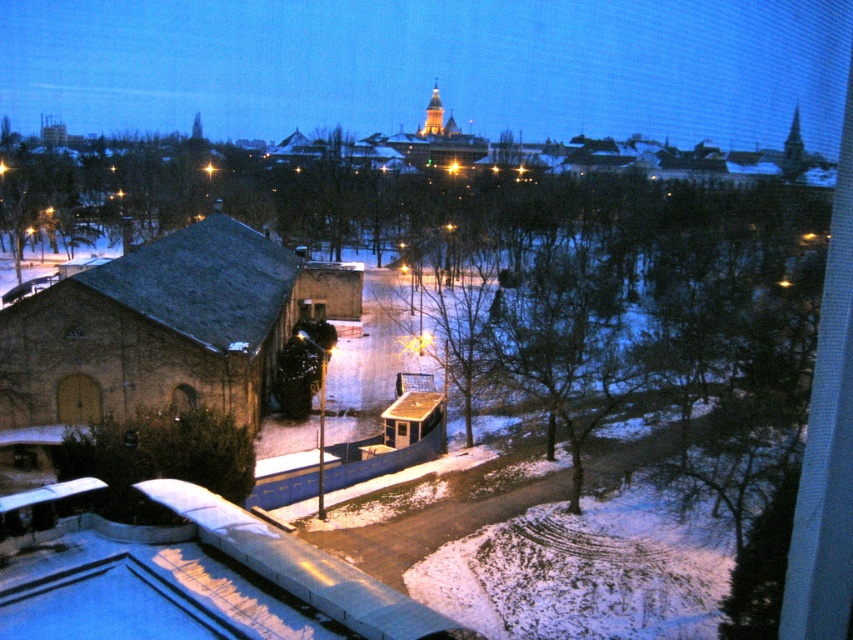
Between point (180, 243) and point (402, 435), which one is positioned behind?

The point (180, 243) is behind.

Does brown stone church at left have a lesser width compared to transparent glass window at center?

Incorrect, brown stone church at left's width is not less than transparent glass window at center's.

Between point (350, 269) and point (403, 426), which one is positioned in front?

Point (403, 426) is more forward.

I want to click on brown stone church at left, so click(x=165, y=324).

From the picture: Does wooden door at lower left lie behind transparent glass window at center?

No, wooden door at lower left is closer to the viewer.

Who is more forward, (85, 388) or (405, 426)?

Point (85, 388)

The image size is (853, 640). Find the location of `wooden door at lower left`. wooden door at lower left is located at coordinates (78, 400).

Is point (184, 397) in front of point (403, 428)?

That is True.

Does transparent glass window at lower left come in front of transparent glass window at center?

Yes, it is in front of transparent glass window at center.

This screenshot has width=853, height=640. What do you see at coordinates (183, 401) in the screenshot?
I see `transparent glass window at lower left` at bounding box center [183, 401].

Where is `transparent glass window at lower left`? Image resolution: width=853 pixels, height=640 pixels. transparent glass window at lower left is located at coordinates (183, 401).